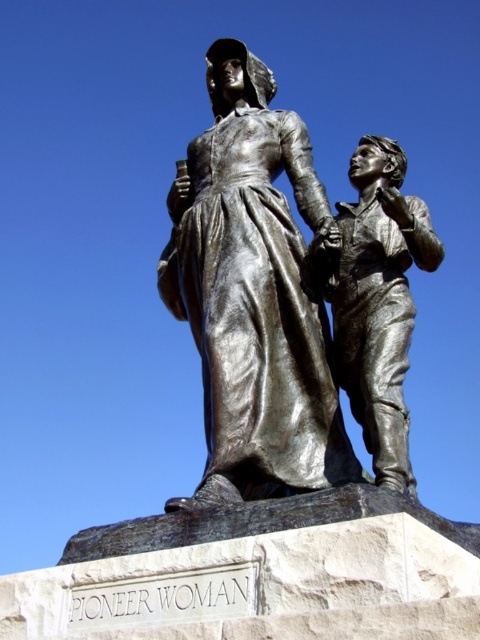
You are a tour guide explaining the layout of the sculpture garden. Where exactly is the shiny bronze statue at center positioned in the garden?

The shiny bronze statue at center is located at point [253,294].

You are an art conservator assessing the space requirements for transporting the bronze statues. The shiny bronze statue at center and the polished bronze statue at center need to be moved. Based on their dimensions, which one requires more space in width?

The shiny bronze statue at center might be wider than polished bronze statue at center, so it requires more space in width.